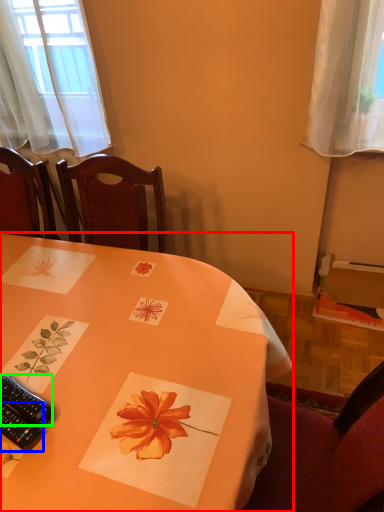
Question: Which object is positioned closest to table (highlighted by a red box)? Select from remote control (highlighted by a blue box) and remote control (highlighted by a green box).

Choices:
 (A) remote control
 (B) remote control

Answer: (B)